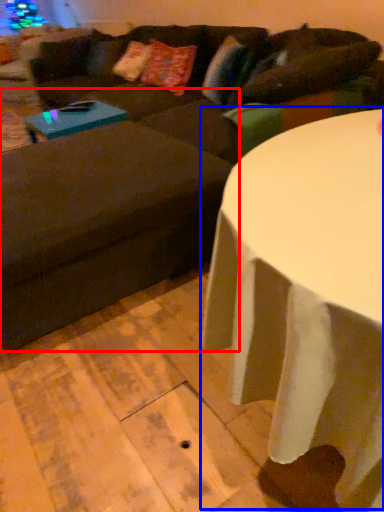
Question: Among these objects, which one is nearest to the camera, swivel chair (highlighted by a red box) or table (highlighted by a blue box)?

Choices:
 (A) swivel chair
 (B) table

Answer: (B)